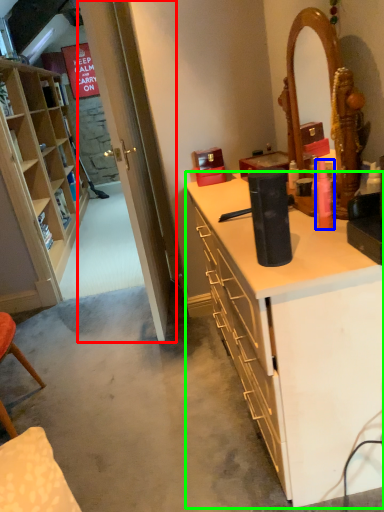
Question: Considering the real-world distances, which object is farthest from glass door (highlighted by a red box)? toiletry (highlighted by a blue box) or desk (highlighted by a green box)?

Choices:
 (A) toiletry
 (B) desk

Answer: (A)